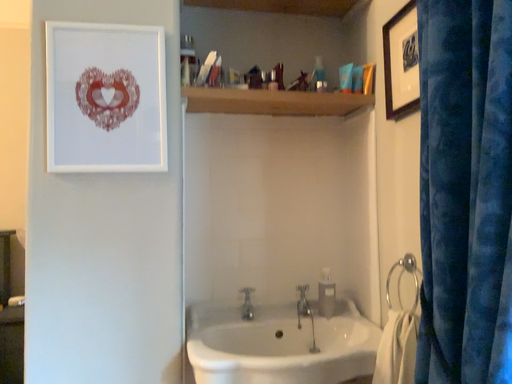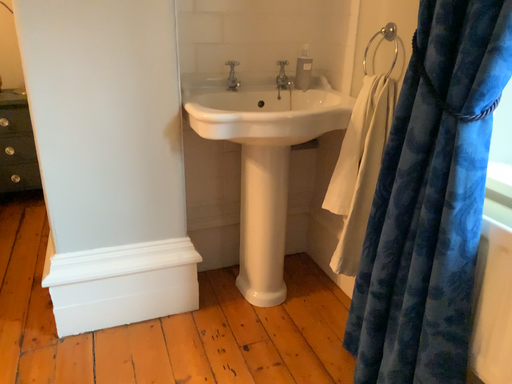
Question: How did the camera likely rotate when shooting the video?

Choices:
 (A) rotated upward
 (B) rotated downward

Answer: (B)